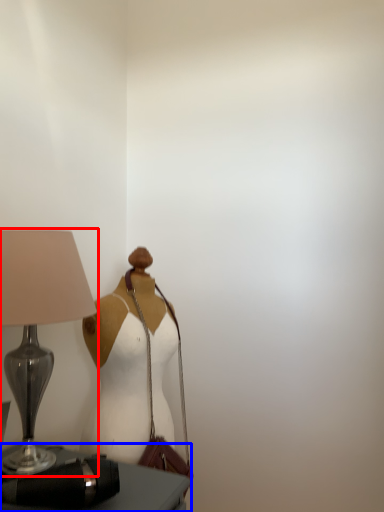
Question: Among these objects, which one is farthest to the camera, lamp (highlighted by a red box) or furniture (highlighted by a blue box)?

Choices:
 (A) lamp
 (B) furniture

Answer: (A)